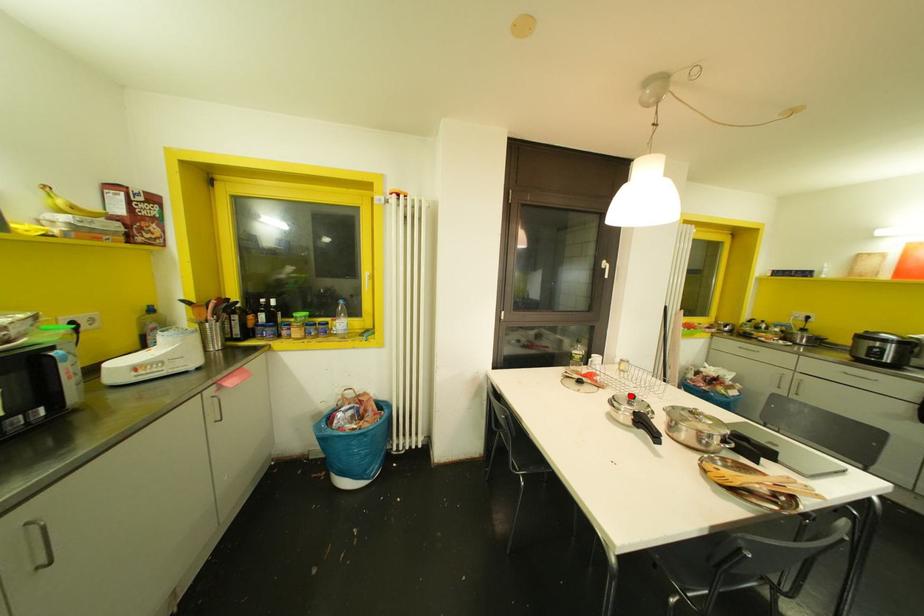
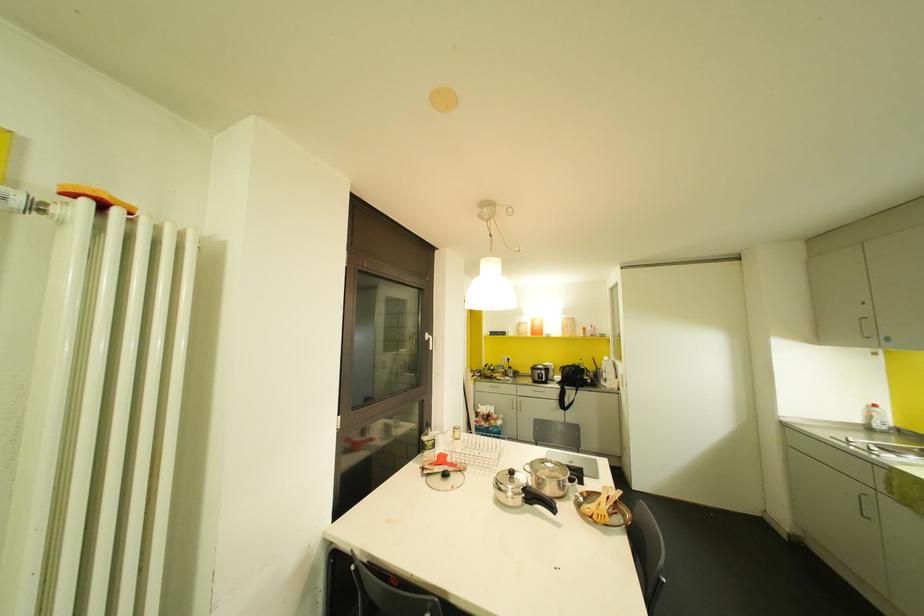
Find the pixel in the second image that matches the highlighted location in the first image.

(511, 472)